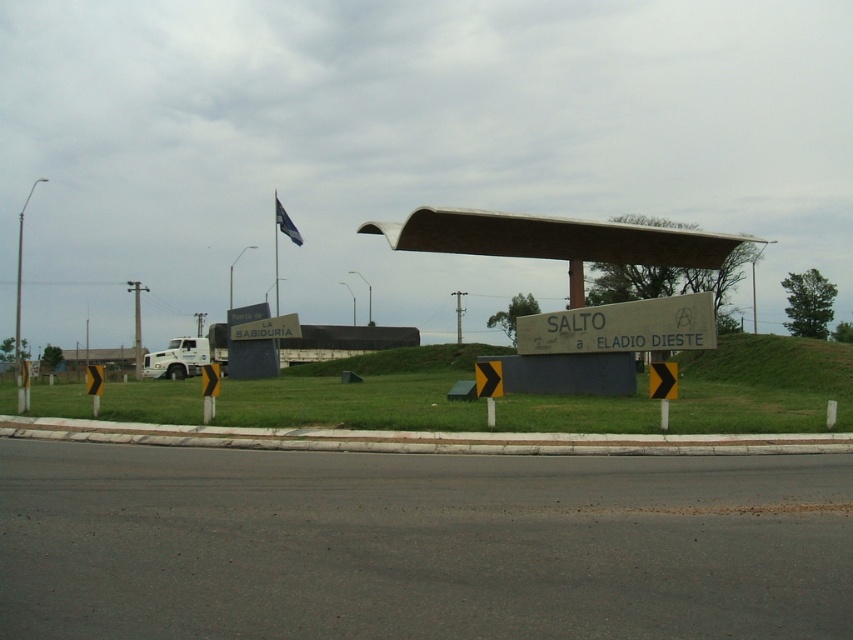
Looking at this image, you are a tourist trying to read both the concrete sign at center and the wooden sign at center. Which one is bigger?

The concrete sign at center has a larger size compared to the wooden sign at center, so the concrete sign at center is bigger.